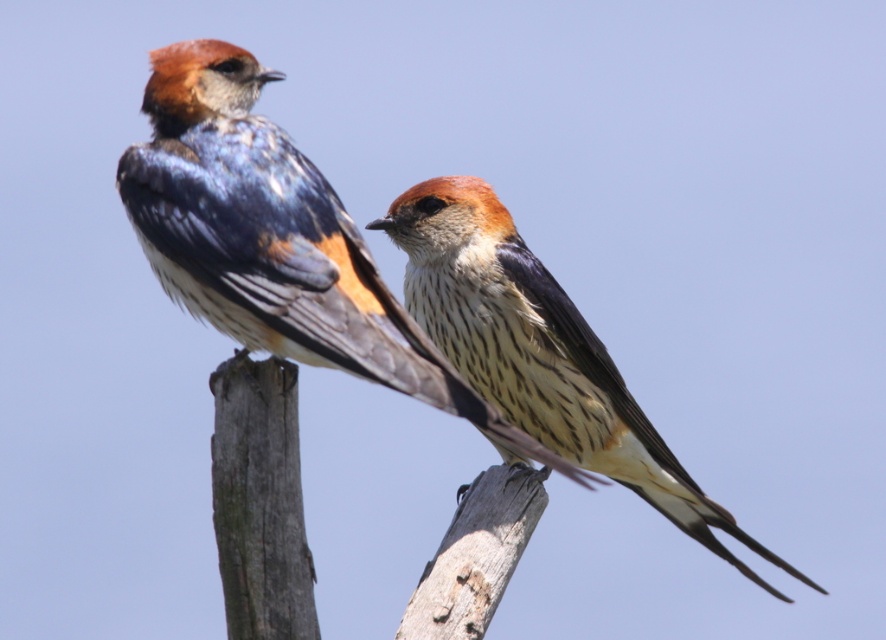
Question: Does speckled feathered swallow at center appear on the left side of speckled feathered bird at center?

Choices:
 (A) yes
 (B) no

Answer: (A)

Question: Among these points, which one is nearest to the camera?

Choices:
 (A) (470, 188)
 (B) (478, 403)

Answer: (B)

Question: Does speckled feathered swallow at center have a smaller size compared to speckled feathered bird at center?

Choices:
 (A) no
 (B) yes

Answer: (A)

Question: Can you confirm if speckled feathered swallow at center is bigger than speckled feathered bird at center?

Choices:
 (A) yes
 (B) no

Answer: (A)